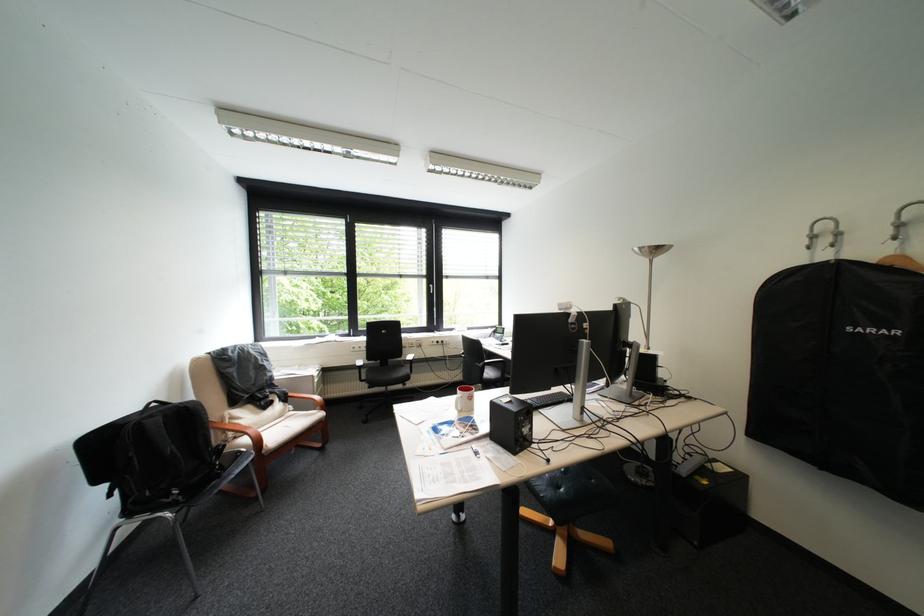
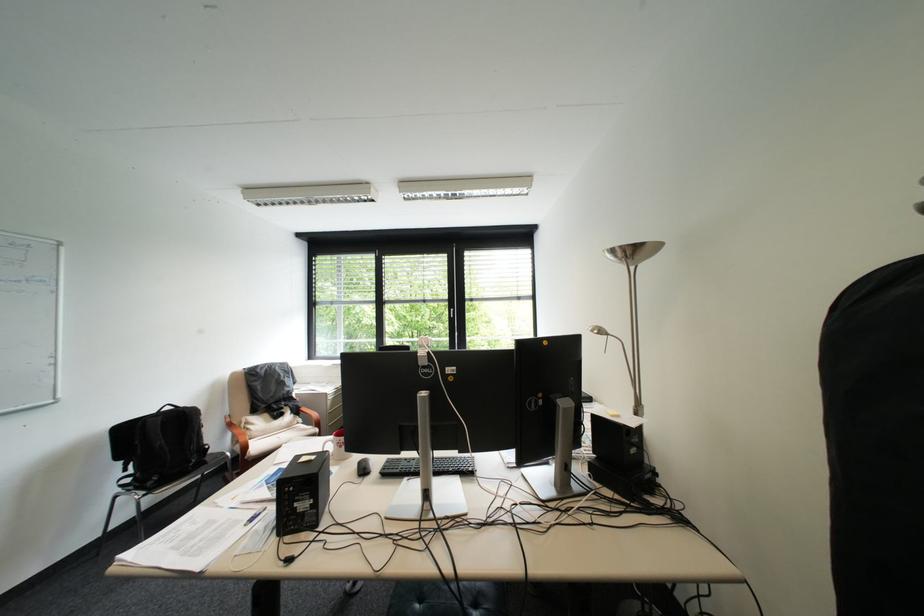
The images are taken continuously from a first-person perspective. In which direction are you moving?

The movement direction of the cameraman is right, forward.